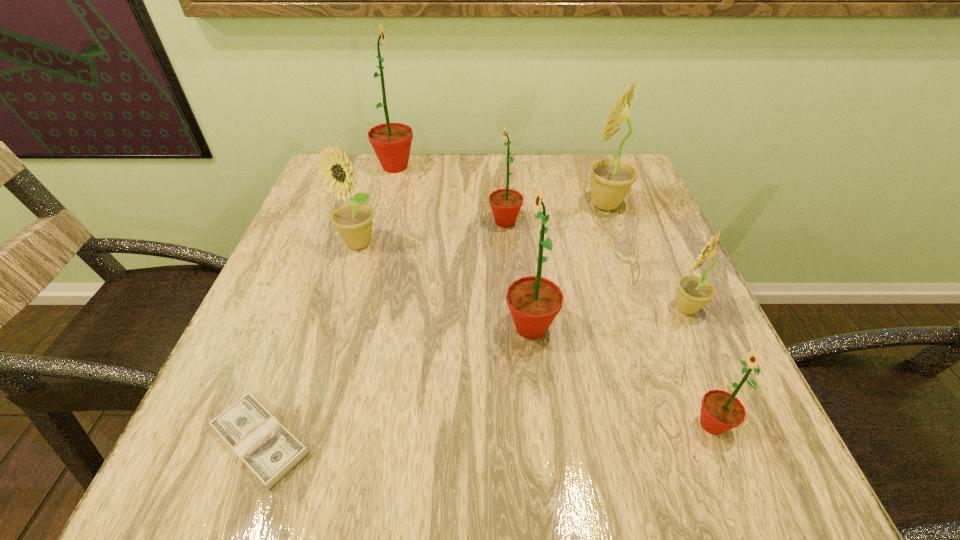
You are a GUI agent. You are given a task and a screenshot of the screen. Output one action in this format:
    pyautogui.click(x=<x>, y=<y>)
    Task: Click on the vacant space that satisfies the following two spatial constraints: 1. on the face of the nearest yellow sunflower; 2. on the front side of the dollar
    
    Given the screenshot: What is the action you would take?
    pyautogui.click(x=746, y=441)